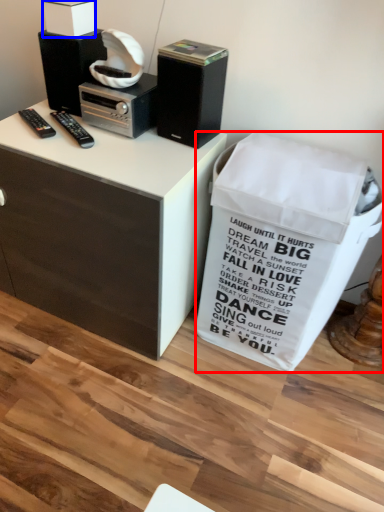
Question: Which object appears farthest to the camera in this image, trash bin/can (highlighted by a red box) or box (highlighted by a blue box)?

Choices:
 (A) trash bin/can
 (B) box

Answer: (B)